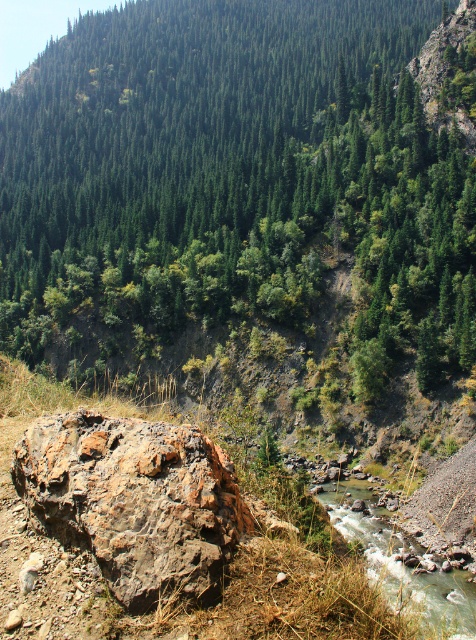
Question: Considering the real-world distances, which object is farthest from the rusty rock at center?

Choices:
 (A) green matte tree at upper center
 (B) white gravelly water at lower center

Answer: (A)

Question: Among these objects, which one is nearest to the camera?

Choices:
 (A) green matte tree at upper center
 (B) rusty rock at center

Answer: (B)

Question: Is green matte tree at upper center further to camera compared to white gravelly water at lower center?

Choices:
 (A) yes
 (B) no

Answer: (A)

Question: Is green matte tree at upper center above white gravelly water at lower center?

Choices:
 (A) yes
 (B) no

Answer: (A)

Question: Is green matte tree at upper center bigger than rusty rock at center?

Choices:
 (A) yes
 (B) no

Answer: (A)

Question: Among these points, which one is nearest to the camera?

Choices:
 (A) (178, 529)
 (B) (373, 497)

Answer: (A)